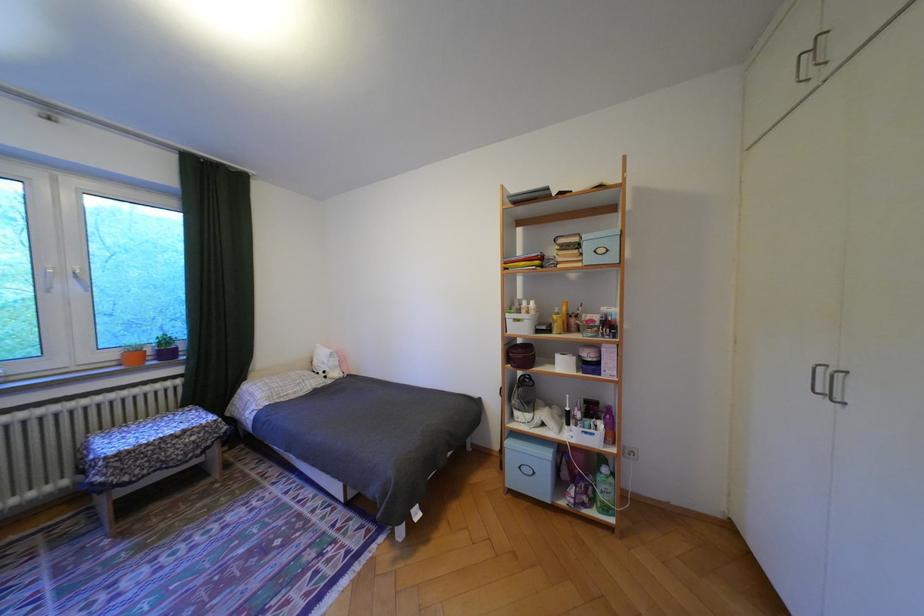
Locate an element on the screen. Image resolution: width=924 pixels, height=616 pixels. orange flower pot is located at coordinates (132, 355).